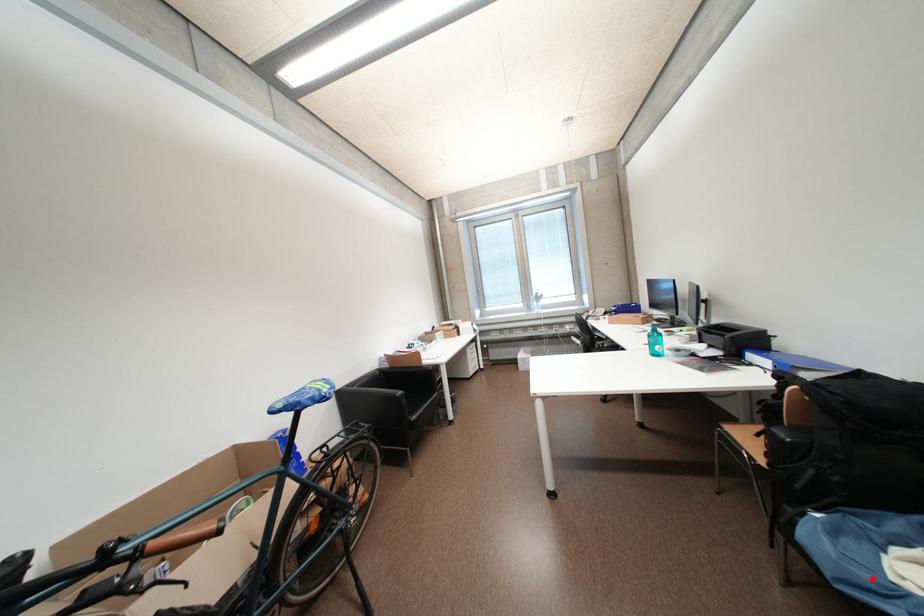
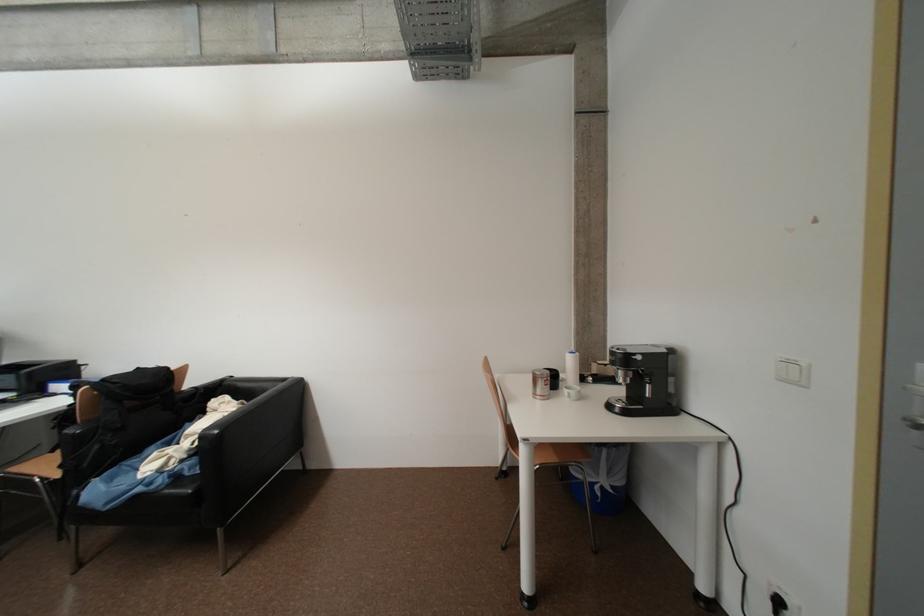
Question: I am providing you with two images of the same scene from different viewpoints. Given a red point in image1, look at the same physical point in image2. Is it:

Choices:
 (A) Closer to the viewpoint
 (B) Farther from the viewpoint

Answer: (A)